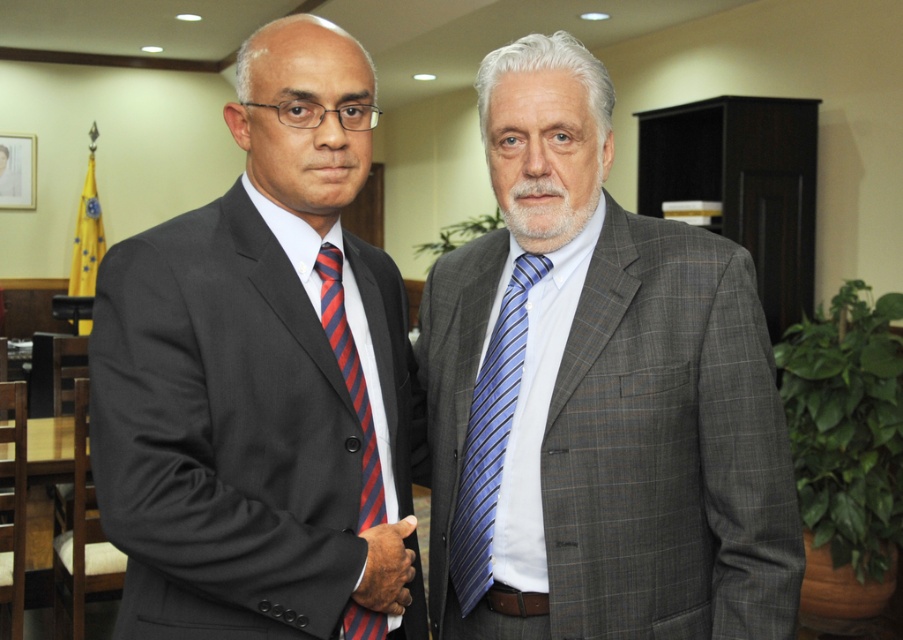
Question: Which of these objects is positioned farthest from the matte black suit at left?

Choices:
 (A) red striped tie at left
 (B) blue striped tie at right
 (C) gray checkered suit at right

Answer: (C)

Question: Estimate the real-world distances between objects in this image. Which object is closer to the gray checkered suit at right?

Choices:
 (A) blue striped tie at right
 (B) matte black suit at left

Answer: (A)

Question: Can you confirm if matte black suit at left is positioned above blue striped tie at right?

Choices:
 (A) no
 (B) yes

Answer: (B)

Question: Is gray checkered suit at right above red striped tie at left?

Choices:
 (A) yes
 (B) no

Answer: (A)

Question: Does blue striped tie at right appear under red striped tie at left?

Choices:
 (A) no
 (B) yes

Answer: (B)

Question: Which object is the closest to the blue striped tie at right?

Choices:
 (A) gray checkered suit at right
 (B) matte black suit at left

Answer: (A)